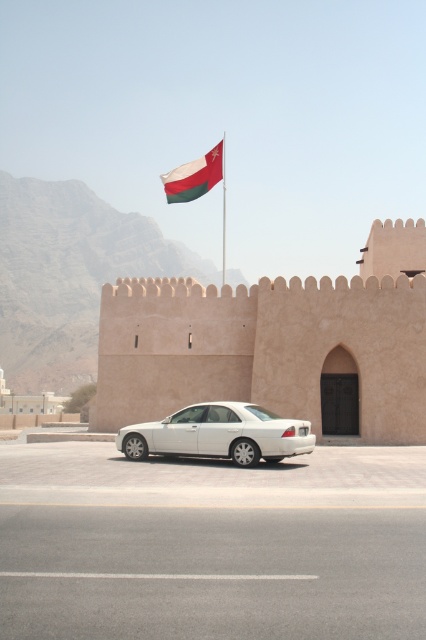
At what (x,y) coordinates should I click in order to perform the action: click on matte beige wall at center. Please return your answer as a coordinate pair (x, y). Looking at the image, I should click on (276, 344).

Is point (146, 401) less distant than point (224, 166)?

Yes, point (146, 401) is in front of point (224, 166).

What do you see at coordinates (276, 344) in the screenshot?
I see `matte beige wall at center` at bounding box center [276, 344].

Locate an element on the screen. The width and height of the screenshot is (426, 640). matte beige wall at center is located at coordinates (276, 344).

Which is above, matte beige wall at center or white glossy sedan at center?

matte beige wall at center is higher up.

Does matte beige wall at center have a greater height compared to white glossy sedan at center?

Yes, matte beige wall at center is taller than white glossy sedan at center.

Does point (365, 253) come closer to viewer compared to point (229, 429)?

That is False.

Where is `matte beige wall at center`? The image size is (426, 640). matte beige wall at center is located at coordinates (276, 344).

Does white glossy sedan at center lie behind olive green fabric flag at upper center?

No, white glossy sedan at center is closer to the viewer.

Which is more to the left, white glossy sedan at center or olive green fabric flag at upper center?

olive green fabric flag at upper center is more to the left.

Between point (210, 412) and point (172, 182), which one is positioned behind?

The point (172, 182) is more distant.

Where is `white glossy sedan at center`? The height and width of the screenshot is (640, 426). white glossy sedan at center is located at coordinates (218, 435).